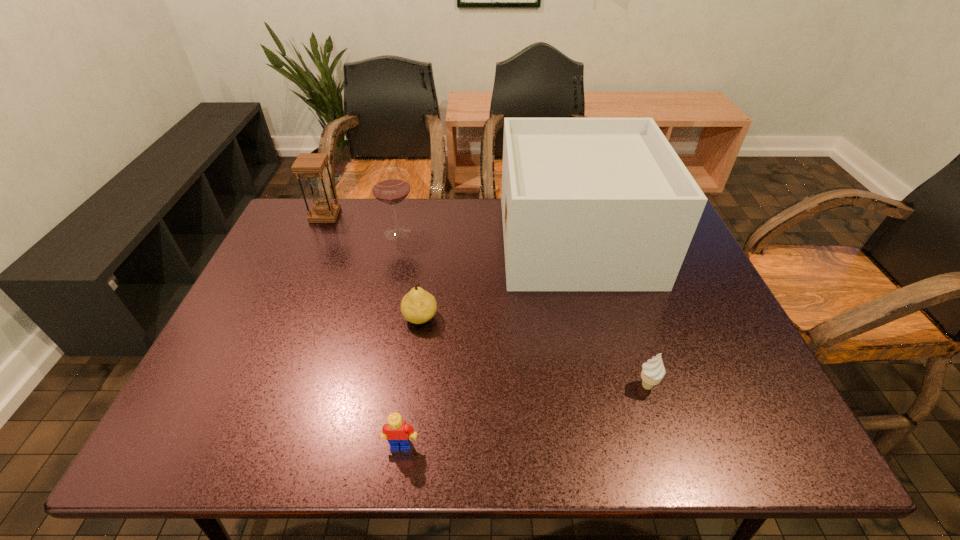
Where is `the tallest object`? The height and width of the screenshot is (540, 960). the tallest object is located at coordinates (588, 204).

At what (x,y) coordinates should I click in order to perform the action: click on the leftmost object. Please return your answer as a coordinate pair (x, y). Looking at the image, I should click on (312, 165).

Find the location of a particular element. Image resolution: width=960 pixels, height=540 pixels. the fifth object from right to left is located at coordinates (390, 186).

Where is `the fourth farthest object`? This screenshot has height=540, width=960. the fourth farthest object is located at coordinates (418, 306).

Locate an element on the screen. icecream is located at coordinates (653, 371).

Locate an element on the screen. The height and width of the screenshot is (540, 960). Lego is located at coordinates (398, 433).

At what (x,y) coordinates should I click in order to perform the action: click on vacant region located on the side of the tallest object with the window. Please return your answer as a coordinate pair (x, y). Looking at the image, I should click on (378, 241).

At what (x,y) coordinates should I click in order to perform the action: click on blank area located 0.370m on the side of the tallest object with the window. Please return your answer as a coordinate pair (x, y). Looking at the image, I should click on (382, 241).

The image size is (960, 540). I want to click on vacant space located on the side of the tallest object with the window, so click(392, 241).

Image resolution: width=960 pixels, height=540 pixels. Find the location of `blank area located 0.310m on the right of the leftmost object`. blank area located 0.310m on the right of the leftmost object is located at coordinates click(x=433, y=215).